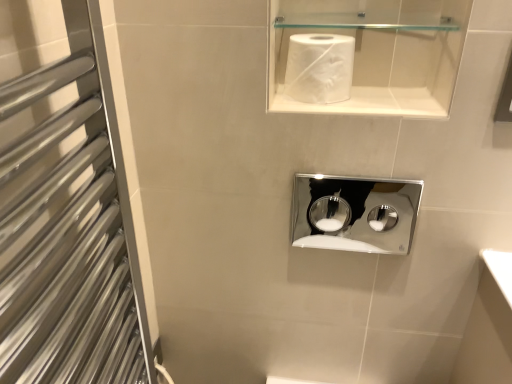
Question: From the image's perspective, is chrome/metallic medicine cabinet at center positioned above or below white matte paper towel at upper center?

Choices:
 (A) below
 (B) above

Answer: (A)

Question: In terms of width, does chrome/metallic medicine cabinet at center look wider or thinner when compared to white matte paper towel at upper center?

Choices:
 (A) wide
 (B) thin

Answer: (B)

Question: Which of these objects is positioned closest to the white matte paper towel at upper center?

Choices:
 (A) chrome/metallic medicine cabinet at center
 (B) silver metallic towel rack at left

Answer: (B)

Question: Which is farther from the white matte paper towel at upper center?

Choices:
 (A) silver metallic towel rack at left
 (B) chrome/metallic medicine cabinet at center

Answer: (B)